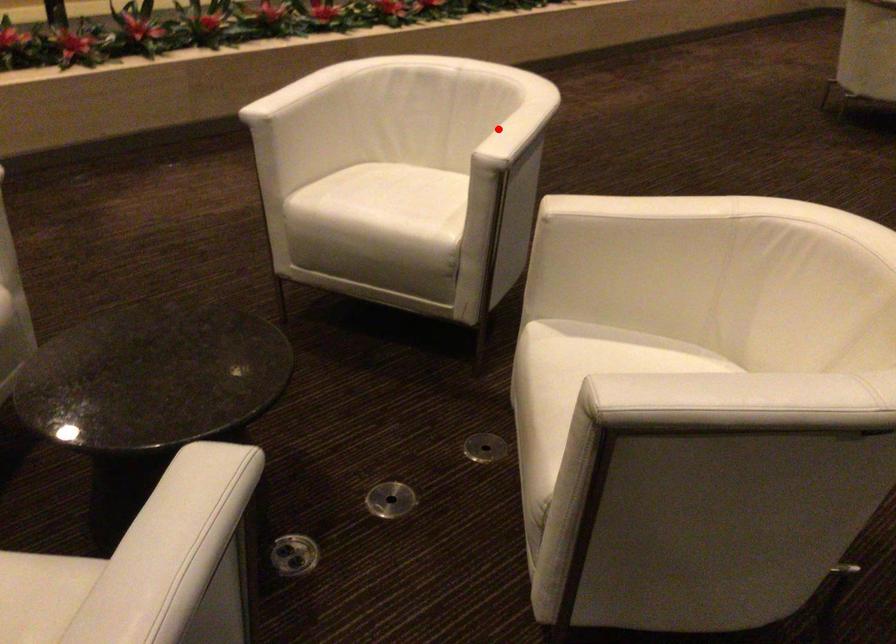
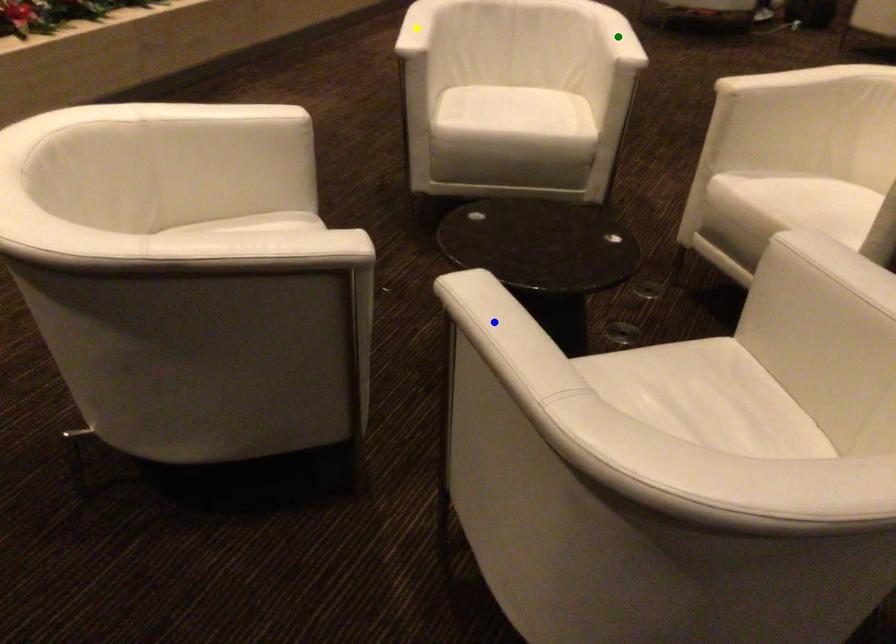
Question: I am providing you with two images of the same scene from different viewpoints. A red point is marked on the first image. You are given multiple points on the second image. In image 2, which mark is for the same physical point as the one in image 1?

Choices:
 (A) blue point
 (B) green point
 (C) yellow point

Answer: (B)